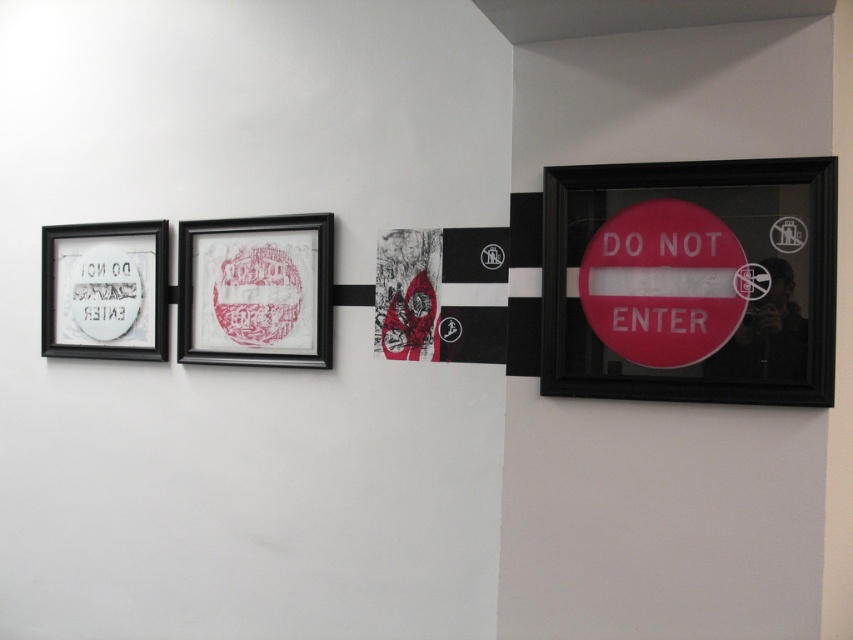
Based on the photo, you are an interior designer planning to hang a new artwork in this room. You have a new piece that is 30 cm wide. The matte paper picture frame at center and the red textured fabric at center are already present. Which existing artwork can the new piece fit next to without overlapping?

The new 30 cm wide artwork can fit next to the red textured fabric at center because the matte paper picture frame at center is larger in size than the red textured fabric at center, so the new piece would be comparable in size to the red textured fabric at center.

You are an interior designer planning to install a new light fixture between the red glossy sign at right and the matte paper picture frame at center. The fixture requires a minimum of 4 feet of space between the two objects to avoid overcrowding. Based on the image, is the distance sufficient?

The red glossy sign at right is 3.32 feet away from the matte paper picture frame at center. Since 3.32 feet is less than the required 4 feet, the distance is insufficient for the light fixture installation.